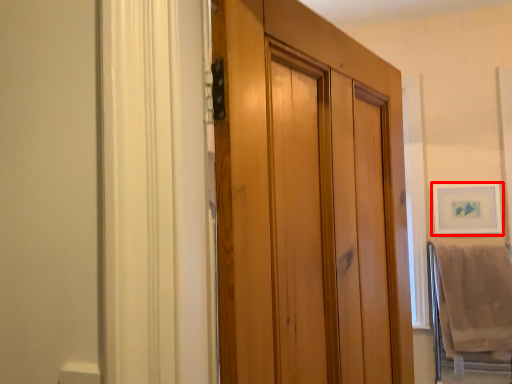
Question: From the image, what is the correct spatial relationship of picture frame (annotated by the red box) in relation to bath towel?

Choices:
 (A) right
 (B) left

Answer: (A)